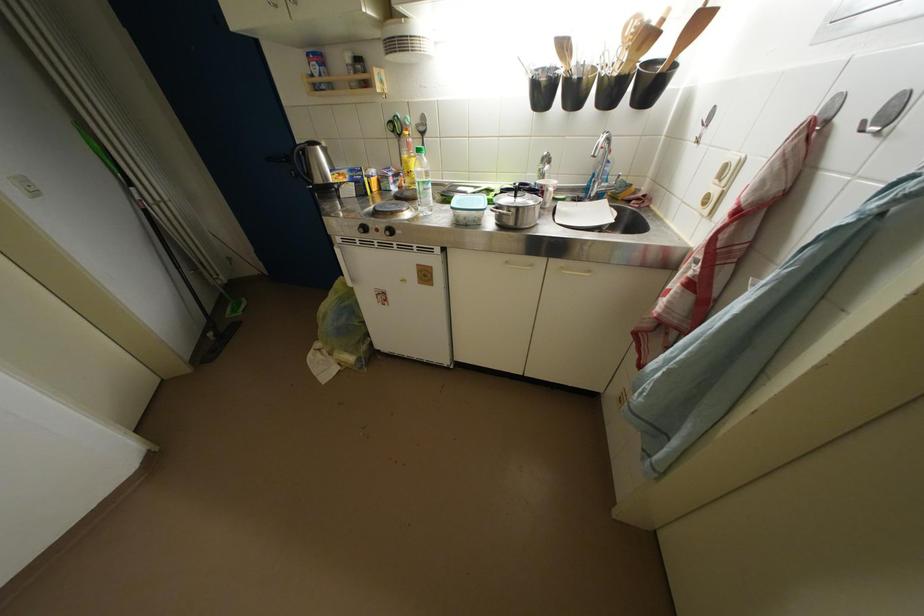
Find where to lift the yellow oil bottle. Please return your answer as a coordinate pair (x, y).

(407, 156)